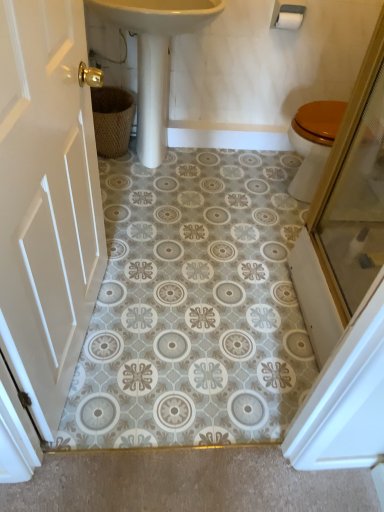
Question: Can you confirm if white matte toilet paper at upper right is wider than woven brown basket at left?

Choices:
 (A) yes
 (B) no

Answer: (B)

Question: Is white matte toilet paper at upper right positioned before woven brown basket at left?

Choices:
 (A) yes
 (B) no

Answer: (A)

Question: Is white matte toilet paper at upper right thinner than woven brown basket at left?

Choices:
 (A) no
 (B) yes

Answer: (B)

Question: Does white matte toilet paper at upper right turn towards woven brown basket at left?

Choices:
 (A) yes
 (B) no

Answer: (B)

Question: Is white matte toilet paper at upper right at the right side of woven brown basket at left?

Choices:
 (A) no
 (B) yes

Answer: (B)

Question: Can you confirm if white matte toilet paper at upper right is bigger than woven brown basket at left?

Choices:
 (A) yes
 (B) no

Answer: (B)

Question: Is woven brown basket at left far from white wood door at left?

Choices:
 (A) yes
 (B) no

Answer: (A)

Question: Can you confirm if woven brown basket at left is taller than white wood door at left?

Choices:
 (A) no
 (B) yes

Answer: (A)

Question: Is woven brown basket at left closer to camera compared to white wood door at left?

Choices:
 (A) yes
 (B) no

Answer: (B)

Question: Does woven brown basket at left come behind white wood door at left?

Choices:
 (A) no
 (B) yes

Answer: (B)

Question: Is woven brown basket at left positioned with its back to white wood door at left?

Choices:
 (A) yes
 (B) no

Answer: (B)

Question: Are woven brown basket at left and white wood door at left beside each other?

Choices:
 (A) yes
 (B) no

Answer: (B)

Question: From a real-world perspective, is white wood door at left under white matte toilet paper at upper right?

Choices:
 (A) no
 (B) yes

Answer: (B)